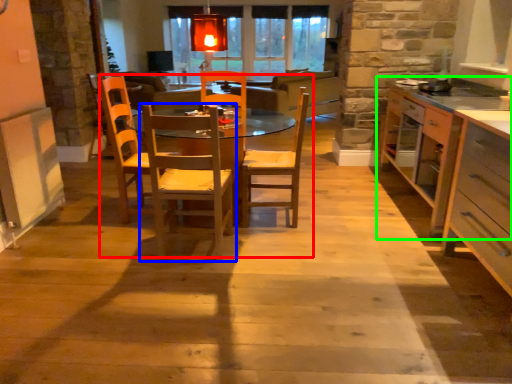
Question: Which object is the farthest from kitchen & dining room table (highlighted by a red box)? Choose among these: chair (highlighted by a blue box) or countertop (highlighted by a green box).

Choices:
 (A) chair
 (B) countertop

Answer: (B)